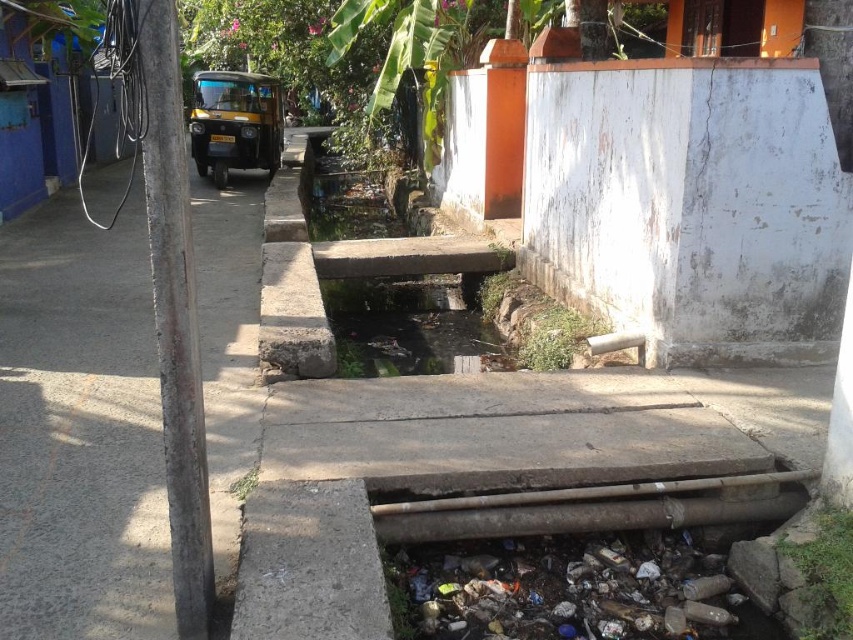
Between gray concrete pavement at left and clear concrete water at center, which one has more height?

clear concrete water at center is taller.

Between gray concrete pavement at left and clear concrete water at center, which one appears on the right side from the viewer's perspective?

clear concrete water at center

Where is `gray concrete pavement at left`? The image size is (853, 640). gray concrete pavement at left is located at coordinates (80, 432).

The width and height of the screenshot is (853, 640). Identify the location of gray concrete pavement at left. (80, 432).